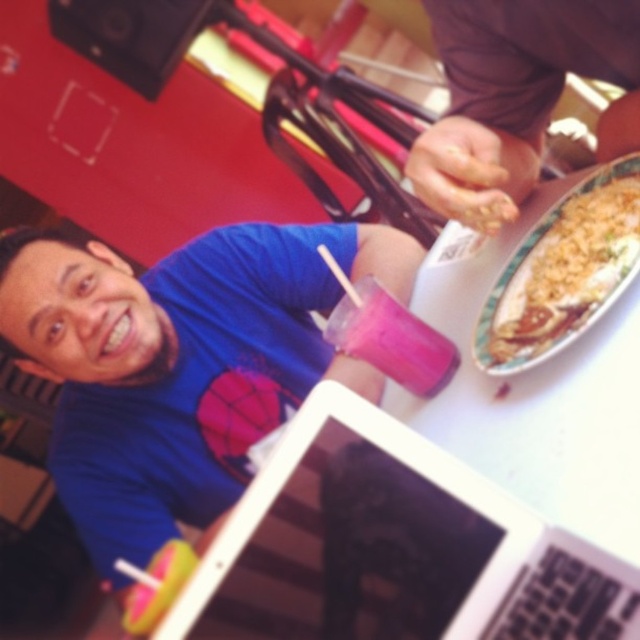
Question: Is brown matte hand at upper center in front of pink matte cup at center?

Choices:
 (A) no
 (B) yes

Answer: (B)

Question: Does blue matte shirt at center have a smaller size compared to pink matte cup at center?

Choices:
 (A) yes
 (B) no

Answer: (B)

Question: Where is brown matte hand at upper center located in relation to yellowish rice at right in the image?

Choices:
 (A) right
 (B) left

Answer: (B)

Question: Based on their relative distances, which object is farther from the white glossy laptop at center?

Choices:
 (A) brown matte hand at upper center
 (B) blue matte shirt at center

Answer: (B)

Question: Which object is closer to the camera taking this photo?

Choices:
 (A) white glossy laptop at center
 (B) pink matte cup at center
 (C) brown matte hand at upper center

Answer: (A)

Question: Which is farther from the white glossy laptop at center?

Choices:
 (A) yellowish rice at right
 (B) brown matte hand at upper center
 (C) pink matte cup at center
 (D) blue matte shirt at center

Answer: (D)